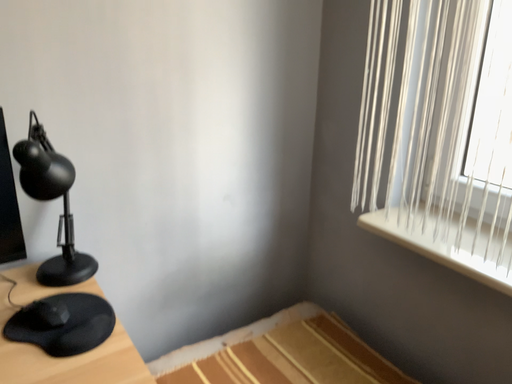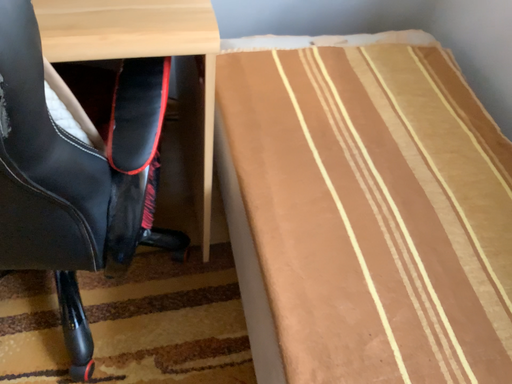
Question: Which way did the camera rotate in the video?

Choices:
 (A) rotated downward
 (B) rotated upward

Answer: (A)